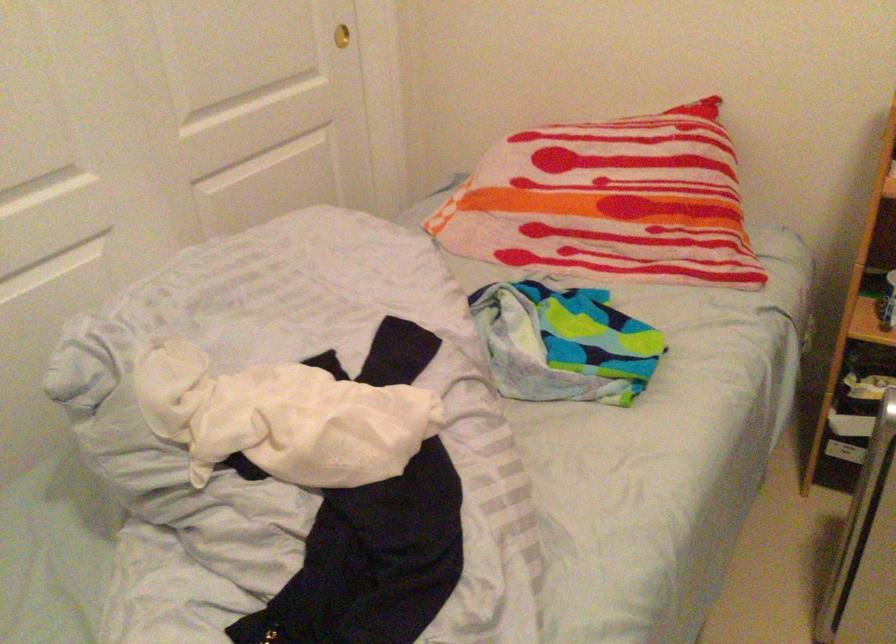
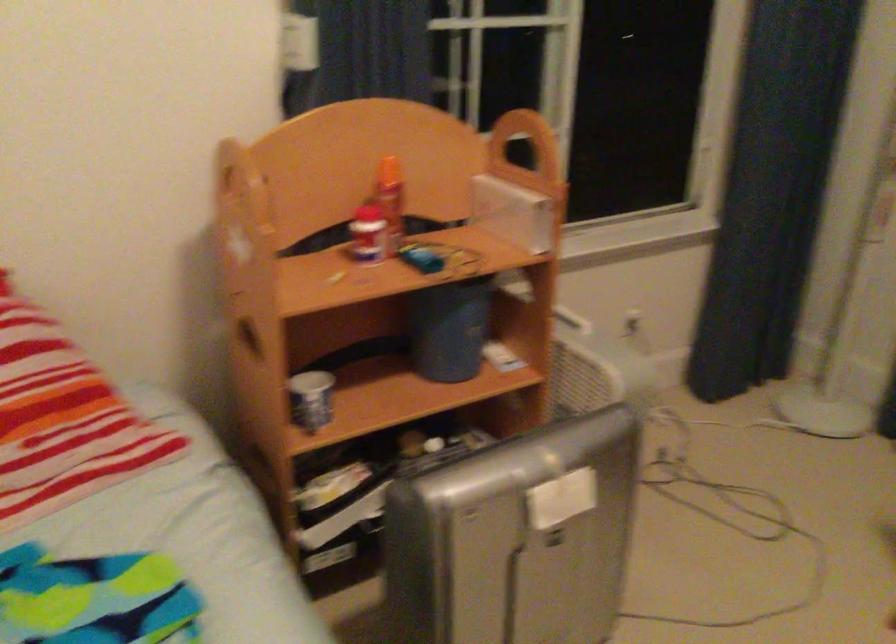
Question: The camera is either moving clockwise (left) or counter-clockwise (right) around the object. The first image is from the beginning of the video and the second image is from the end. Is the camera moving left or right when shooting the video?

Choices:
 (A) Left
 (B) Right

Answer: (A)